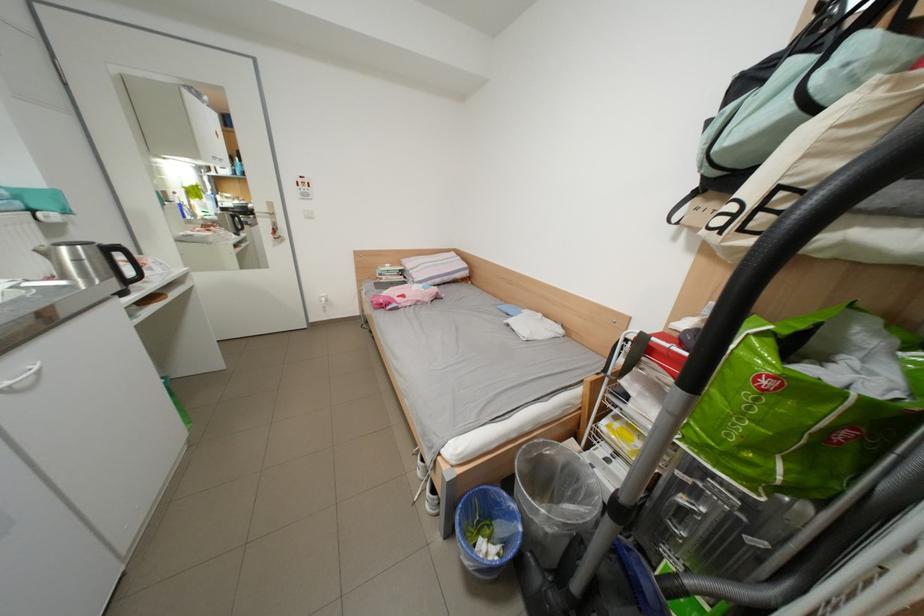
Find where to pull the white cabinet handle. Please return your answer as a coordinate pair (x, y).

(79, 461)